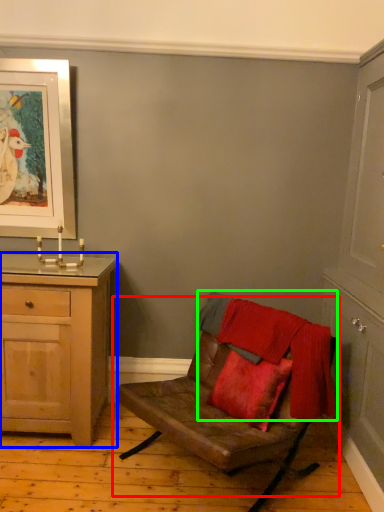
Question: Estimate the real-world distances between objects in this image. Which object is farther from chair (highlighted by a red box), chest of drawers (highlighted by a blue box) or blanket (highlighted by a green box)?

Choices:
 (A) chest of drawers
 (B) blanket

Answer: (A)